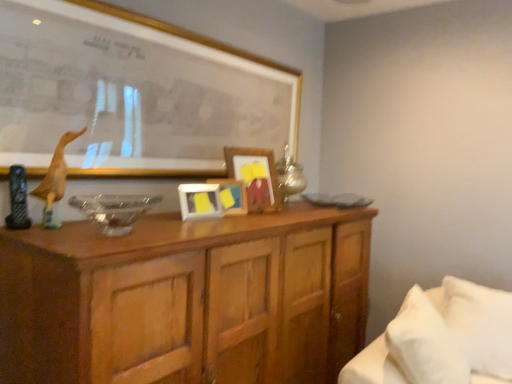
Question: From the image's perspective, is white soft pillow at lower right located above or below matte yellow picture frame at center, the second picture frame in the front-to-back sequence?

Choices:
 (A) below
 (B) above

Answer: (A)

Question: Looking at their shapes, would you say white soft pillow at lower right is wider or thinner than matte yellow picture frame at center, which ranks as the third picture frame in back-to-front order?

Choices:
 (A) wide
 (B) thin

Answer: (A)

Question: Which of these objects is positioned farthest from the white soft bed at lower right?

Choices:
 (A) wooden duckling at left
 (B) wooden picture frame at center, the first picture frame from the back
 (C) wooden cabinet at center
 (D) matte gold picture frame at upper center, positioned as the 4th picture frame in back-to-front order
 (E) yellow matte picture frame at center, which is the second picture frame in back-to-front order

Answer: (A)

Question: Considering the real-world distances, which object is closest to the wooden cabinet at center?

Choices:
 (A) matte gold picture frame at upper center, which appears as the first picture frame when viewed from the front
 (B) wooden picture frame at center, the fourth picture frame viewed from the front
 (C) white soft bed at lower right
 (D) yellow matte picture frame at center, acting as the 3th picture frame starting from the front
 (E) matte yellow picture frame at center, the second picture frame in the front-to-back sequence

Answer: (E)